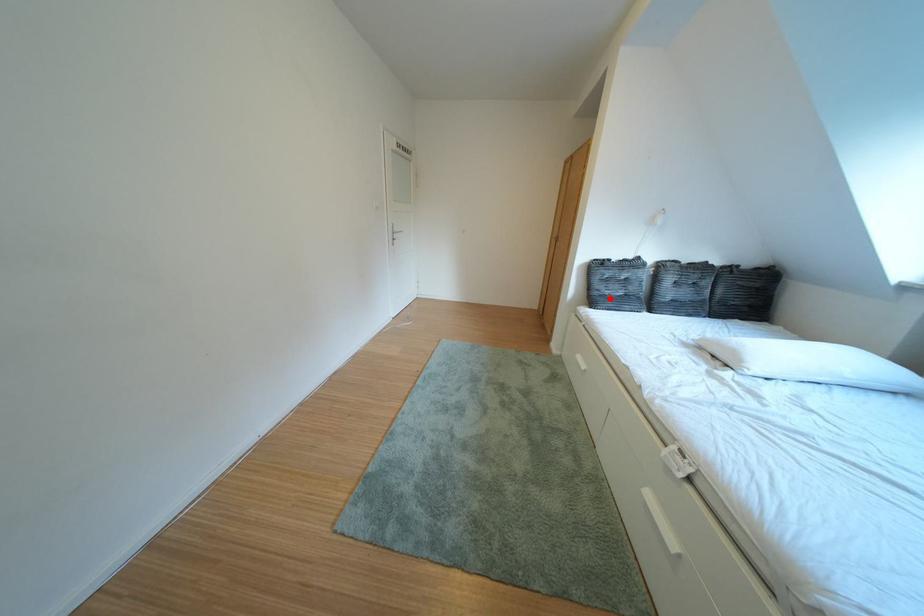
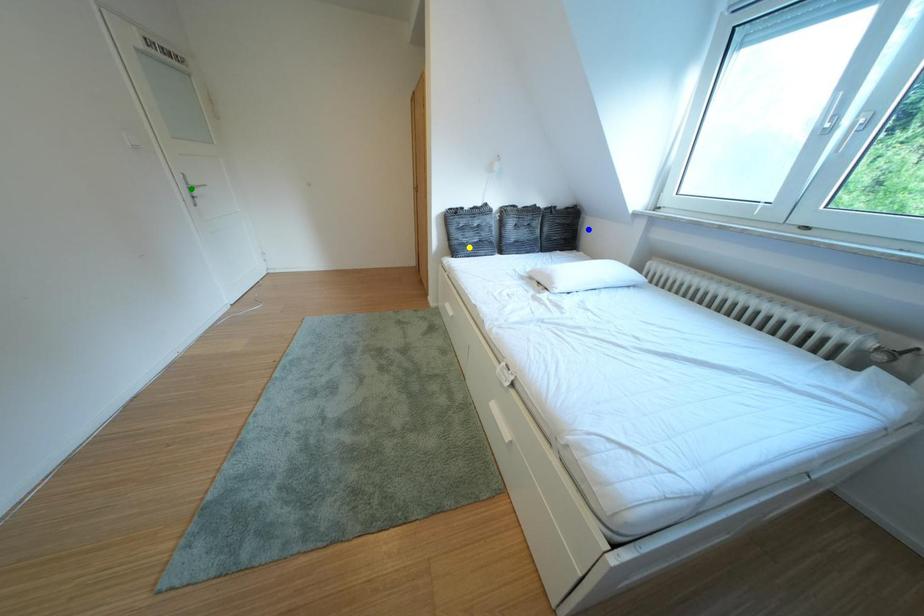
Question: I am providing you with two images of the same scene from different viewpoints. A red point is marked on the first image. You are given multiple points on the second image. Can you choose the point in image 2 that corresponds to the point in image 1?

Choices:
 (A) yellow point
 (B) blue point
 (C) green point

Answer: (A)